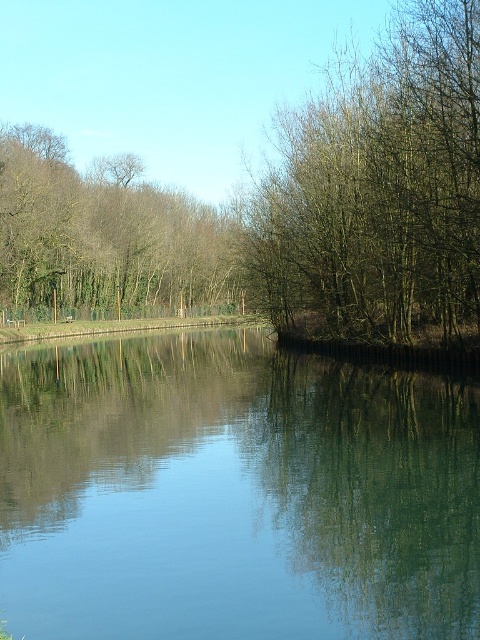
Question: Is transparent water at center wider than brown leafless trees at upper left?

Choices:
 (A) no
 (B) yes

Answer: (A)

Question: Based on their relative distances, which object is nearer to the transparent water at center?

Choices:
 (A) brown leafless trees at upper left
 (B) bare branches at center

Answer: (B)

Question: Which point is farther to the camera?

Choices:
 (A) (146, 220)
 (B) (365, 323)
 (C) (55, 627)

Answer: (A)

Question: Which of the following is the farthest from the observer?

Choices:
 (A) (96, 467)
 (B) (264, 230)

Answer: (B)

Question: Does transparent water at center have a greater width compared to brown leafless trees at upper left?

Choices:
 (A) no
 (B) yes

Answer: (A)

Question: Is bare branches at center above brown leafless trees at upper left?

Choices:
 (A) no
 (B) yes

Answer: (A)